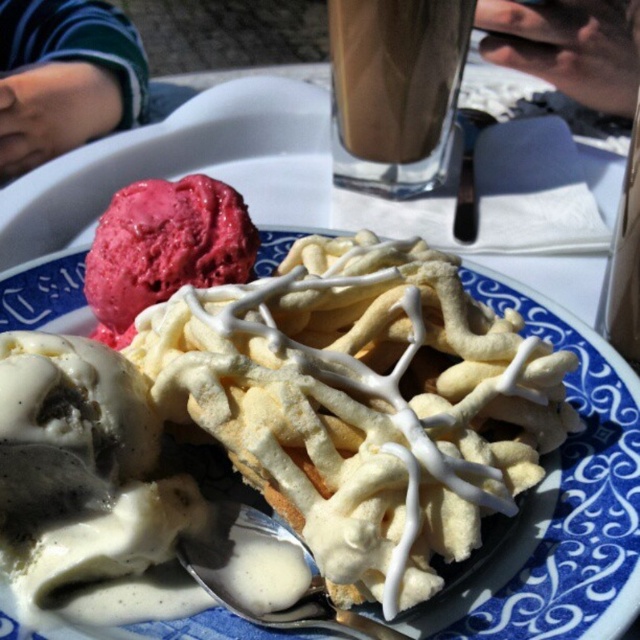
Question: Does white glazed waffle at center appear on the left side of translucent glass cup at upper center?

Choices:
 (A) no
 (B) yes

Answer: (B)

Question: Observing the image, what is the correct spatial positioning of translucent glass cup at upper center in reference to smooth raspberry ice cream at upper left?

Choices:
 (A) below
 (B) above

Answer: (B)

Question: Which object is closer to the camera taking this photo?

Choices:
 (A) translucent glass cup at upper center
 (B) smooth raspberry ice cream at upper left
 (C) white glazed waffle at center

Answer: (C)

Question: Which point is closer to the camera?

Choices:
 (A) (548, 445)
 (B) (419, 45)

Answer: (A)

Question: Which of the following is the farthest from the observer?

Choices:
 (A) (404, 451)
 (B) (433, 164)

Answer: (B)

Question: Is white glazed waffle at center further to the viewer compared to smooth raspberry ice cream at upper left?

Choices:
 (A) yes
 (B) no

Answer: (B)